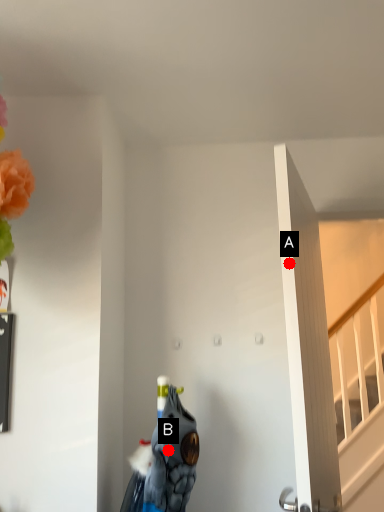
Question: Two points are circled on the image, labeled by A and B beside each circle. Which point is farther from the camera taking this photo?

Choices:
 (A) A is further
 (B) B is further

Answer: (B)